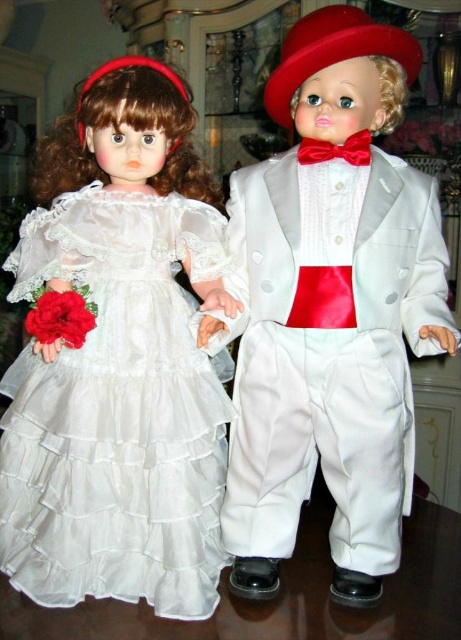
Which is above, satin white suit at center or wooden table at center?

satin white suit at center is above.

Can you confirm if satin white suit at center is positioned to the right of wooden table at center?

Correct, you'll find satin white suit at center to the right of wooden table at center.

What do you see at coordinates (330, 360) in the screenshot? The width and height of the screenshot is (461, 640). I see `satin white suit at center` at bounding box center [330, 360].

This screenshot has height=640, width=461. I want to click on satin white suit at center, so click(x=330, y=360).

Between satin white suit at center and white satin dress at left, which one is positioned higher?

satin white suit at center is higher up.

Is satin white suit at center behind white satin dress at left?

No.

The height and width of the screenshot is (640, 461). Find the location of `satin white suit at center`. satin white suit at center is located at coordinates (330, 360).

Is wooden table at center positioned behind red velvet hat at upper left?

No.

Who is lower down, wooden table at center or red velvet hat at upper left?

Positioned lower is wooden table at center.

This screenshot has width=461, height=640. I want to click on wooden table at center, so click(x=287, y=595).